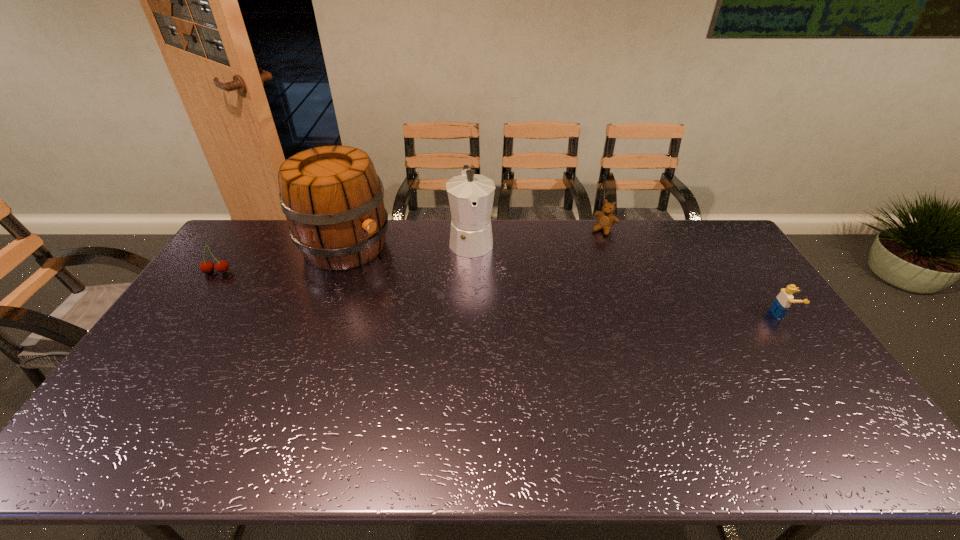
The image size is (960, 540). Find the location of `free spot on the desktop that is between the leftmost object and the rightmost object and is positioned at the spout of the third object from right to left`. free spot on the desktop that is between the leftmost object and the rightmost object and is positioned at the spout of the third object from right to left is located at coordinates (482, 292).

You are a GUI agent. You are given a task and a screenshot of the screen. Output one action in this format:
    pyautogui.click(x=<x>, y=<y>)
    Task: Click on the free spot on the desktop that is between the cherry and the rightmost object and is positioned on the front-facing side of the second object from right to left
    The width and height of the screenshot is (960, 540).
    Given the screenshot: What is the action you would take?
    pyautogui.click(x=553, y=298)

Identify the location of vacant space on the desktop that is between the cherry and the nearest object and is positioned on the side of the fourth object from right to left where the spigot is located. (413, 287).